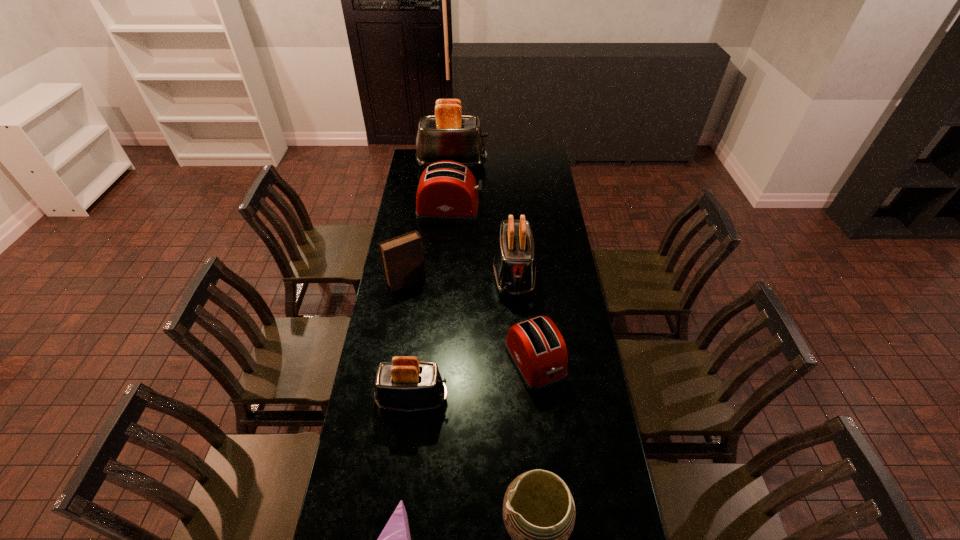
Image resolution: width=960 pixels, height=540 pixels. I want to click on vacant area at the left edge, so click(x=405, y=314).

Find the location of a particular element. vacant space at the right edge is located at coordinates (564, 302).

In the image, there is a desktop. Where is `vacant space at the far right corner`? vacant space at the far right corner is located at coordinates (525, 151).

I want to click on free point between the smaller red toaster and the Bible, so click(x=470, y=322).

I want to click on unoccupied area between the Bible and the tallest object, so click(x=429, y=223).

Locate an element on the screen. The height and width of the screenshot is (540, 960). empty space that is in between the second farthest object and the third nearest toaster is located at coordinates (482, 243).

I want to click on object that stands as the fifth closest to the right red toaster, so click(395, 539).

The height and width of the screenshot is (540, 960). I want to click on object that is the fourth closest to the Bible, so click(x=404, y=384).

Where is `toaster that stands as the third closest to the pottery`? The image size is (960, 540). toaster that stands as the third closest to the pottery is located at coordinates tap(514, 266).

Locate which toaster ranks second in proximity to the brown pottery. Please provide its 2D coordinates. Your answer should be formatted as a tuple, i.e. [(x, y)], where the tuple contains the x and y coordinates of a point satisfying the conditions above.

[(536, 347)]